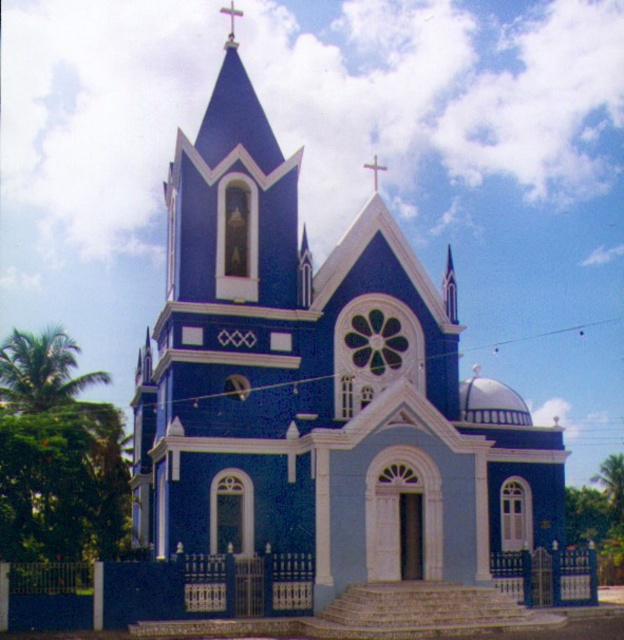
Is metallic cross at upper center thinner than metallic gold cross at upper center?

No.

The image size is (624, 640). I want to click on metallic cross at upper center, so click(x=230, y=19).

Between point (235, 13) and point (373, 164), which one is positioned in front?

Point (373, 164) is in front.

The width and height of the screenshot is (624, 640). I want to click on metallic cross at upper center, so click(x=230, y=19).

Is blue painted stone church at center bigger than metallic cross at upper center?

Indeed, blue painted stone church at center has a larger size compared to metallic cross at upper center.

Is point (441, 316) positioned in front of point (230, 36)?

That is True.

Locate an element on the screen. blue painted stone church at center is located at coordinates (321, 396).

Can you confirm if blue painted stone church at center is positioned below metallic gold cross at upper center?

Yes, blue painted stone church at center is below metallic gold cross at upper center.

Between blue painted stone church at center and metallic gold cross at upper center, which one has more height?

With more height is blue painted stone church at center.

Describe the element at coordinates (321, 396) in the screenshot. I see `blue painted stone church at center` at that location.

The height and width of the screenshot is (640, 624). What are the coordinates of `blue painted stone church at center` in the screenshot? It's located at (321, 396).